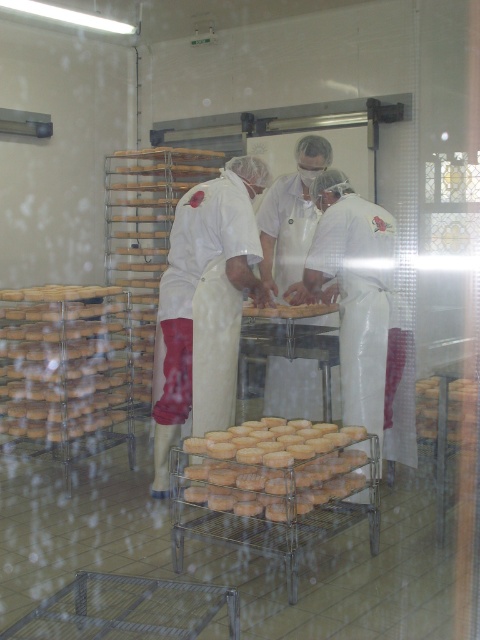
Question: Is white smooth uniform at center to the right of brown crumbly bread at center from the viewer's perspective?

Choices:
 (A) no
 (B) yes

Answer: (A)

Question: Which point is closer to the camera?

Choices:
 (A) (326, 444)
 (B) (117, 336)
 (C) (171, 291)

Answer: (A)

Question: Which is nearer to the golden brown crumbly pastry at center?

Choices:
 (A) white smooth uniform at center
 (B) brown crumbly bread at center

Answer: (B)

Question: Is golden brown crumbly pastry at center positioned at the back of brown crumbly bread at center?

Choices:
 (A) yes
 (B) no

Answer: (B)

Question: Does golden brown crumbly pastry at center appear over brown crumbly bread at center?

Choices:
 (A) no
 (B) yes

Answer: (A)

Question: Estimate the real-world distances between objects in this image. Which object is closer to the white smooth uniform at center?

Choices:
 (A) golden brown doughnuts at left
 (B) golden brown crumbly pastry at center

Answer: (A)